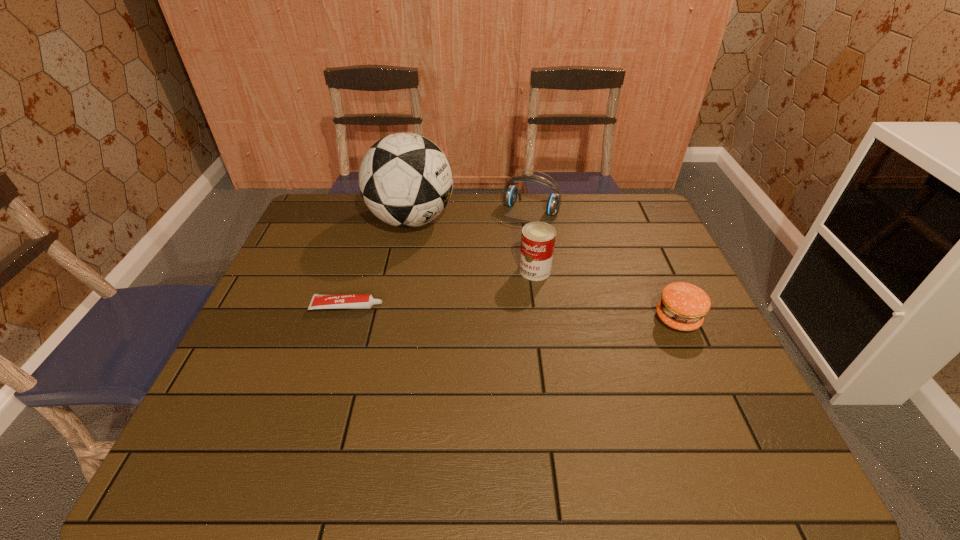
At what (x,y) coordinates should I click in order to perform the action: click on toothpaste. Please return your answer as a coordinate pair (x, y). Looking at the image, I should click on (352, 301).

Find the location of a particular element. the fourth tallest object is located at coordinates (683, 305).

Locate an element on the screen. patty is located at coordinates (683, 305).

Identify the location of soccer ball. (405, 179).

The image size is (960, 540). Identify the location of headset. (510, 194).

Identify the location of the third nearest object. pyautogui.click(x=538, y=238).

At what (x,y) coordinates should I click in order to perform the action: click on free space located 0.080m at the nozzle of the toothpaste. Please return your answer as a coordinate pair (x, y). Looking at the image, I should click on (412, 307).

Where is `vacant region located on the back of the patty`? This screenshot has width=960, height=540. vacant region located on the back of the patty is located at coordinates pyautogui.click(x=651, y=260).

The image size is (960, 540). I want to click on vacant area situated on the surface of the tallest object where the brand logo is visible, so click(x=440, y=250).

At what (x,y) coordinates should I click in order to perform the action: click on vacant region located 0.100m on the surface of the tallest object where the brand logo is visible. Please return your answer as a coordinate pair (x, y). Looking at the image, I should click on (447, 259).